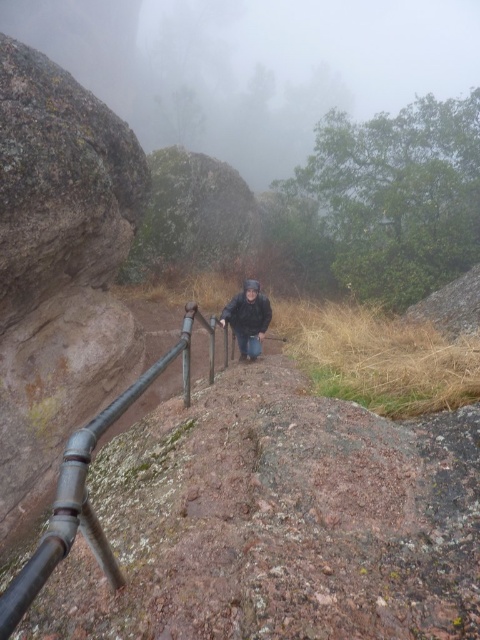
Question: Which of the following is the farthest from the observer?

Choices:
 (A) dark gray jacket at center
 (B) metallic pipe at center

Answer: (A)

Question: Which of the following is the farthest from the observer?

Choices:
 (A) dark gray jacket at center
 (B) metallic pipe at center

Answer: (A)

Question: Which object is closer to the camera taking this photo?

Choices:
 (A) metallic pipe at center
 (B) dark gray jacket at center

Answer: (A)

Question: In this image, where is metallic pipe at center located relative to dark gray jacket at center?

Choices:
 (A) left
 (B) right

Answer: (A)

Question: From the image, what is the correct spatial relationship of metallic pipe at center in relation to dark gray jacket at center?

Choices:
 (A) below
 (B) above

Answer: (A)

Question: Does metallic pipe at center appear on the left side of dark gray jacket at center?

Choices:
 (A) yes
 (B) no

Answer: (A)